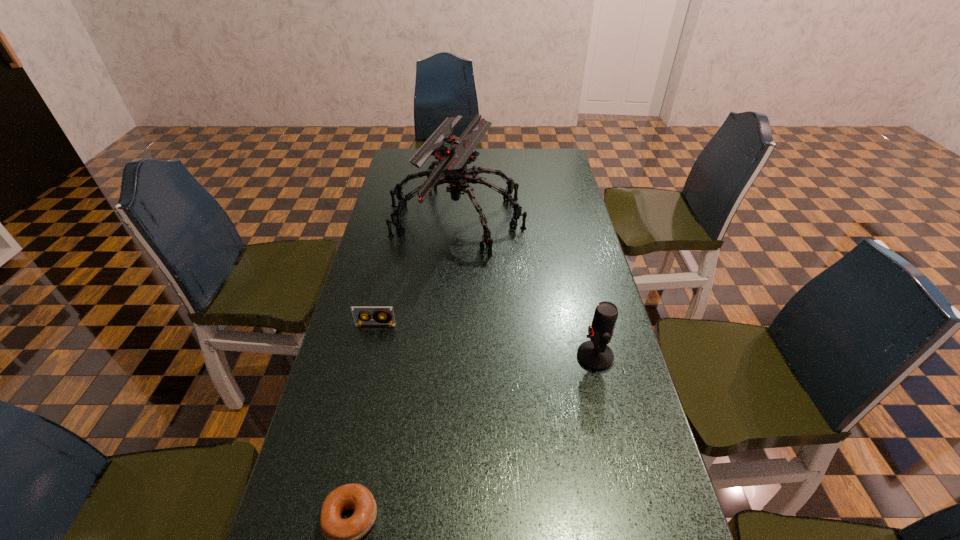
Find the location of a particular element. The image size is (960, 540). free space between the farthest object and the rightmost object is located at coordinates (526, 287).

Locate which object ranks third in proximity to the bagel. Please provide its 2D coordinates. Your answer should be formatted as a tuple, i.e. [(x, y)], where the tuple contains the x and y coordinates of a point satisfying the conditions above.

[(453, 155)]

Select which object is the closest to the third tallest object. Please provide its 2D coordinates. Your answer should be formatted as a tuple, i.e. [(x, y)], where the tuple contains the x and y coordinates of a point satisfying the conditions above.

[(453, 155)]